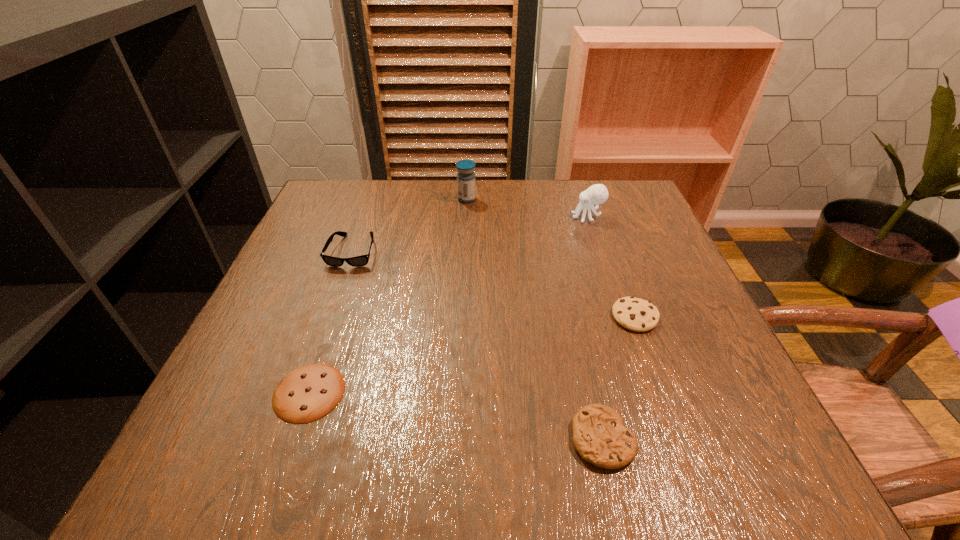
Image resolution: width=960 pixels, height=540 pixels. Find the location of `the farthest object`. the farthest object is located at coordinates (465, 177).

What are the coordinates of `the third object from left to right` in the screenshot? It's located at (465, 177).

What are the coordinates of `the second farthest object` in the screenshot? It's located at (596, 194).

Find the location of a particular element. sunglasses is located at coordinates (358, 261).

This screenshot has height=540, width=960. I want to click on the farthest cookie, so click(x=635, y=314).

Where is `the fourth farthest object`? This screenshot has height=540, width=960. the fourth farthest object is located at coordinates (635, 314).

Find the location of a particular element. the second cookie from right to left is located at coordinates (599, 436).

Where is `the shortest cookie`? the shortest cookie is located at coordinates (308, 393).

Locate an element on the screen. The image size is (960, 540). the shortest object is located at coordinates 308,393.

In order to click on blank space located on the left of the medicine in this screenshot , I will do `click(408, 199)`.